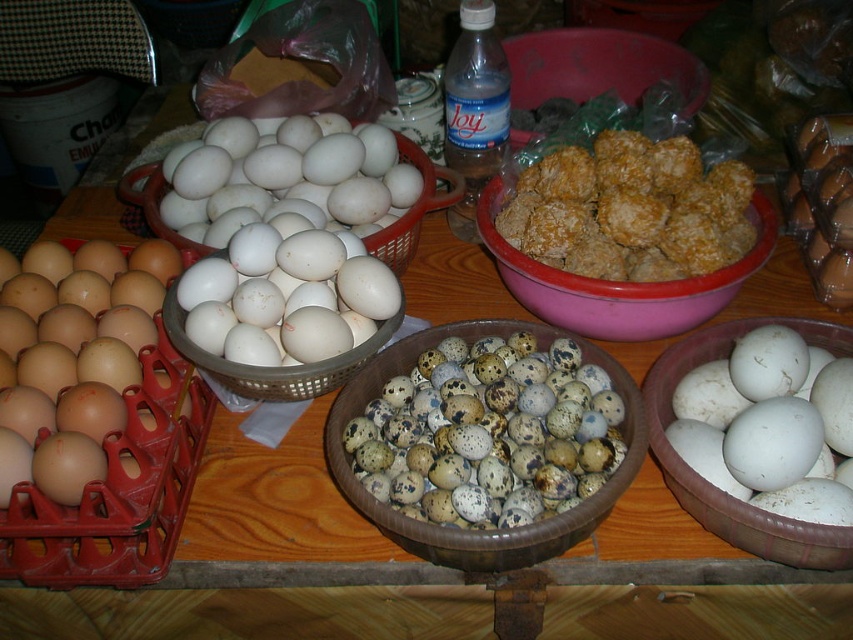
Question: Which object appears closest to the camera in this image?

Choices:
 (A) brown matte egg at left
 (B) white matte eggs at center
 (C) brown crumbly balls at center
 (D) matte plastic bowl at center

Answer: (A)

Question: Which point is closer to the camera?

Choices:
 (A) (532, 92)
 (B) (701, 268)
 (C) (265, 333)

Answer: (C)

Question: Is white matte egg at center smaller than matte plastic bowl at center?

Choices:
 (A) no
 (B) yes

Answer: (B)

Question: Is brown crumbly balls at center above brown plastic crate at left?

Choices:
 (A) no
 (B) yes

Answer: (B)

Question: Does white matte eggs at center appear on the right side of brown crumbly balls at center?

Choices:
 (A) yes
 (B) no

Answer: (B)

Question: Among these points, which one is nearest to the camera?

Choices:
 (A) (206, 332)
 (B) (148, 560)
 (C) (437, 378)

Answer: (B)